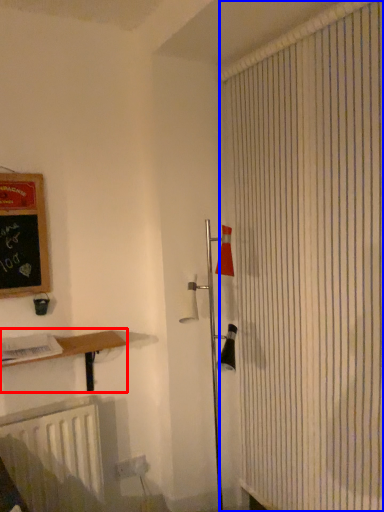
Question: Which object appears farthest to the camera in this image, shelf (highlighted by a red box) or shower curtain (highlighted by a blue box)?

Choices:
 (A) shelf
 (B) shower curtain

Answer: (A)